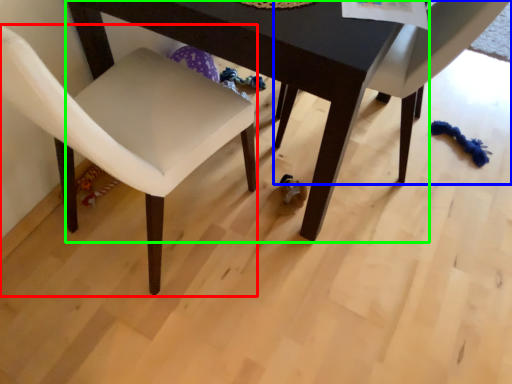
Question: Which object is positioned farthest from chair (highlighted by a red box)? Select from chair (highlighted by a blue box) and table (highlighted by a green box).

Choices:
 (A) chair
 (B) table

Answer: (A)